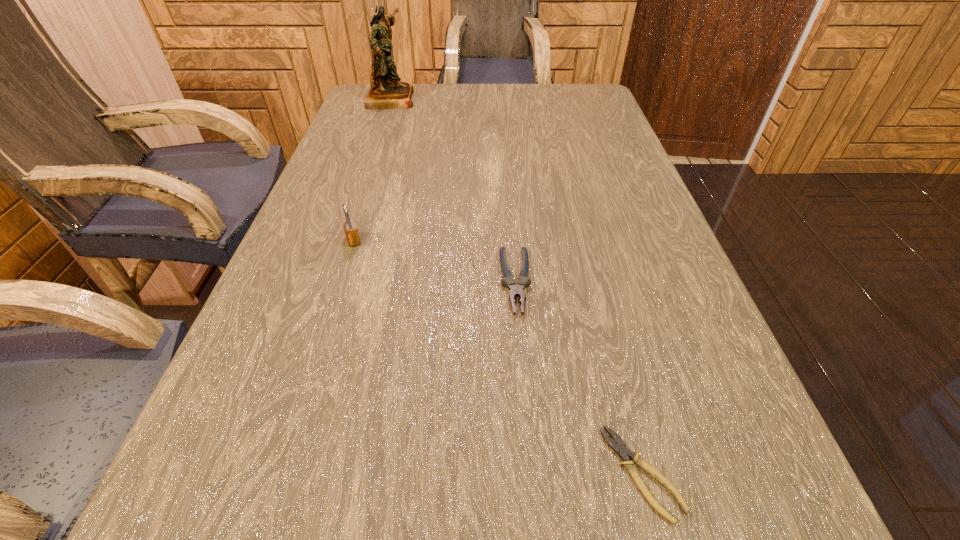
I want to click on vacant space located at the gripping part of the left pliers, so click(x=526, y=418).

You are a GUI agent. You are given a task and a screenshot of the screen. Output one action in this format:
    pyautogui.click(x=<x>, y=<y>)
    Task: Click on the free location located 0.370m on the back of the shorter pliers
    This screenshot has width=960, height=540.
    Given the screenshot: What is the action you would take?
    pyautogui.click(x=585, y=248)

You are a GUI agent. You are given a task and a screenshot of the screen. Output one action in this format:
    pyautogui.click(x=<x>, y=<y>)
    Task: Click on the object located at the far edge
    
    Given the screenshot: What is the action you would take?
    pyautogui.click(x=387, y=91)

You are a GUI agent. You are given a task and a screenshot of the screen. Output one action in this format:
    pyautogui.click(x=<x>, y=<y>)
    Task: Click on the figurine located at the left edge
    
    Given the screenshot: What is the action you would take?
    pyautogui.click(x=387, y=91)

This screenshot has width=960, height=540. I want to click on padlock at the left edge, so click(351, 232).

The height and width of the screenshot is (540, 960). What are the coordinates of `object that is at the right edge` in the screenshot? It's located at (620, 447).

Where is `object located at the far left corner`? The height and width of the screenshot is (540, 960). object located at the far left corner is located at coordinates (387, 91).

In the image, there is a desktop. Where is `free space at the far edge`? The height and width of the screenshot is (540, 960). free space at the far edge is located at coordinates (479, 110).

Where is `vacant region at the left edge of the desktop`? Image resolution: width=960 pixels, height=540 pixels. vacant region at the left edge of the desktop is located at coordinates (357, 183).

Image resolution: width=960 pixels, height=540 pixels. In the image, there is a desktop. In order to click on vacant region at the right edge in this screenshot , I will do `click(715, 357)`.